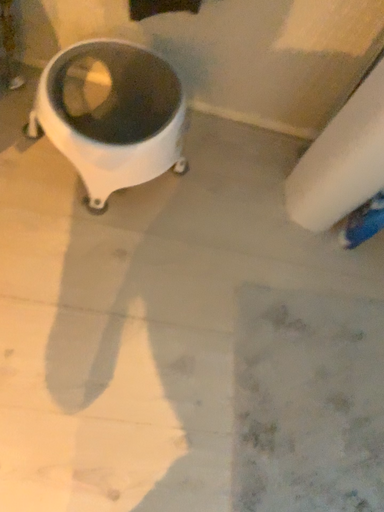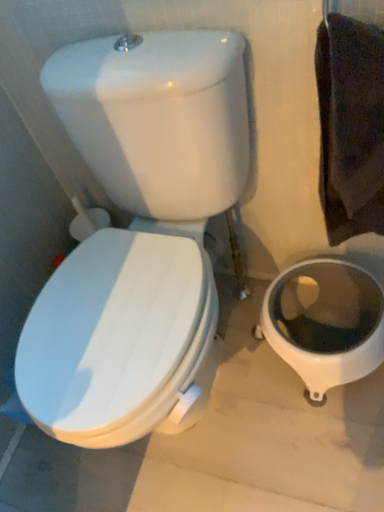
Question: How did the camera likely rotate when shooting the video?

Choices:
 (A) rotated right
 (B) rotated left

Answer: (B)